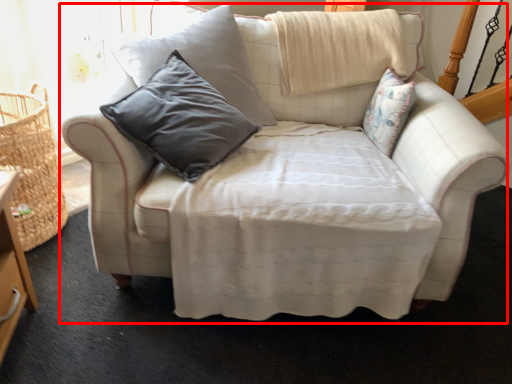
Question: From the image's perspective, what is the correct spatial positioning of studio couch (annotated by the red box) in reference to basket?

Choices:
 (A) above
 (B) below

Answer: (A)